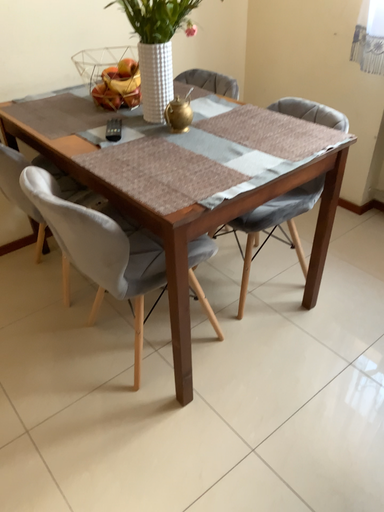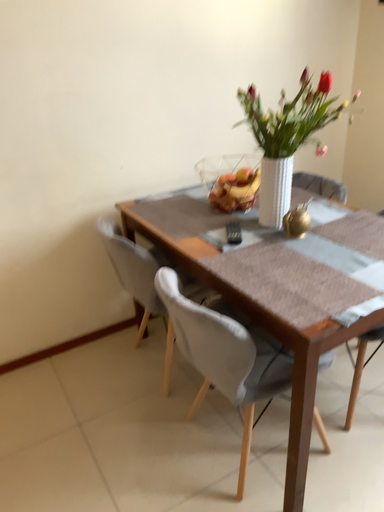
Question: How did the camera likely rotate when shooting the video?

Choices:
 (A) rotated upward
 (B) rotated downward

Answer: (A)